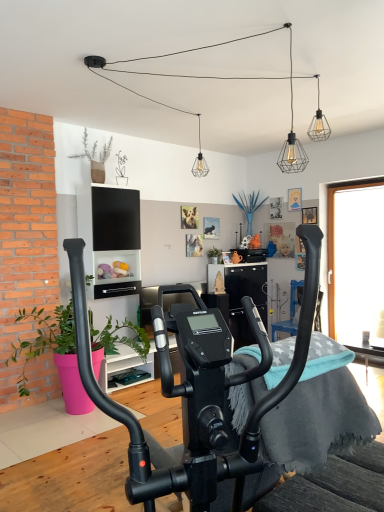
Question: Does wooden table at lower right have a greater height compared to green matte plant at left, arranged as the 1th plant when viewed from the left?

Choices:
 (A) no
 (B) yes

Answer: (A)

Question: Does wooden table at lower right appear on the left side of green matte plant at left, the 1th plant from the front?

Choices:
 (A) yes
 (B) no

Answer: (B)

Question: Is wooden table at lower right shorter than green matte plant at left, the 2th plant in the right-to-left sequence?

Choices:
 (A) yes
 (B) no

Answer: (A)

Question: Does wooden table at lower right have a greater width compared to green matte plant at left, the 1th plant from the front?

Choices:
 (A) no
 (B) yes

Answer: (A)

Question: Does wooden table at lower right come behind green matte plant at left, arranged as the 1th plant when viewed from the left?

Choices:
 (A) yes
 (B) no

Answer: (A)

Question: From the image's perspective, does wooden table at lower right appear higher than green matte plant at left, the 2th plant in the right-to-left sequence?

Choices:
 (A) yes
 (B) no

Answer: (B)

Question: Does green matte plant at center, marked as the 2th plant in a bottom-to-top arrangement, have a greater width compared to green matte plant at left, the 2th plant in the right-to-left sequence?

Choices:
 (A) no
 (B) yes

Answer: (A)

Question: From the image's perspective, is green matte plant at center, arranged as the first plant when viewed from the back, located above green matte plant at left, arranged as the second plant when viewed from the top?

Choices:
 (A) no
 (B) yes

Answer: (B)

Question: Can you confirm if green matte plant at center, marked as the 2th plant in a bottom-to-top arrangement, is shorter than green matte plant at left, the 1th plant from the front?

Choices:
 (A) no
 (B) yes

Answer: (B)

Question: Is green matte plant at left, arranged as the second plant when viewed from the top, inside green matte plant at center, the 2th plant viewed from the left?

Choices:
 (A) yes
 (B) no

Answer: (B)

Question: Can you confirm if green matte plant at center, the 2th plant viewed from the left, is smaller than green matte plant at left, arranged as the 1th plant when viewed from the left?

Choices:
 (A) no
 (B) yes

Answer: (B)

Question: Is the depth of green matte plant at center, the 1th plant when ordered from right to left, greater than that of green matte plant at left, the second plant viewed from the back?

Choices:
 (A) yes
 (B) no

Answer: (A)

Question: Is blue fabric armchair at center further to camera compared to green matte plant at left, the 2th plant in the right-to-left sequence?

Choices:
 (A) yes
 (B) no

Answer: (A)